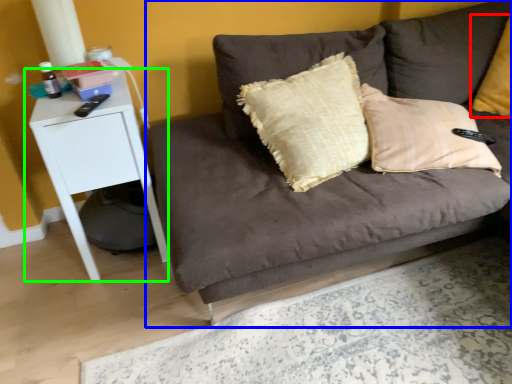
Question: Which object is positioned closest to pillow (highlighted by a red box)? Select from studio couch (highlighted by a blue box) and table (highlighted by a green box).

Choices:
 (A) studio couch
 (B) table

Answer: (A)